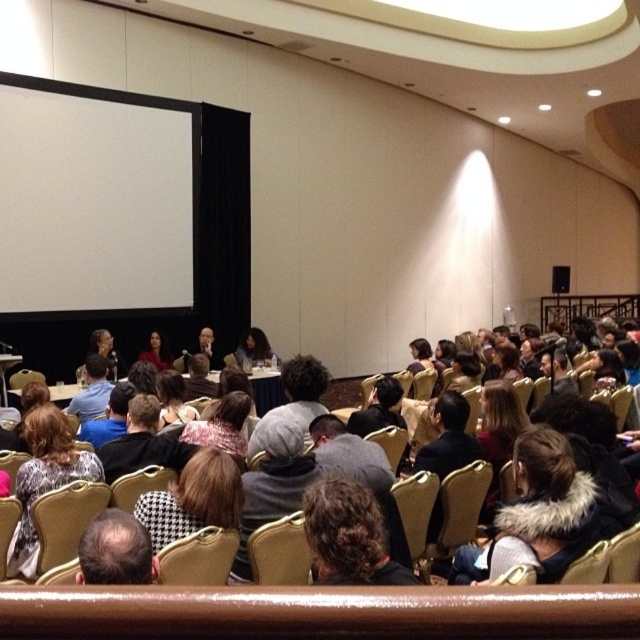
You are an event planner standing at the back of the room. You need to place a 24 inch wide decorative panel between dark curly hair at center and leather at center. Is there enough space for it?

The distance between dark curly hair at center and leather at center is 27.17 inches. Since the panel is 24 inches wide, there is enough space to place it between them.

You are an attendee sitting in the front row of the conference. You notice two items at center stage. Which one is located higher up between dark curly hair at center and leather at center?

The dark curly hair at center is above the leather at center, so it is located higher up.

You are an attendee sitting in the front row of the conference. You notice someone with dark brown hair at lower left. Where exactly is this person located in relation to the stage and the projection screen?

The dark brown hair at lower left is located at point (115, 550), which places them near the lower left corner of the image, close to the stage area but slightly to the left of the projection screen.